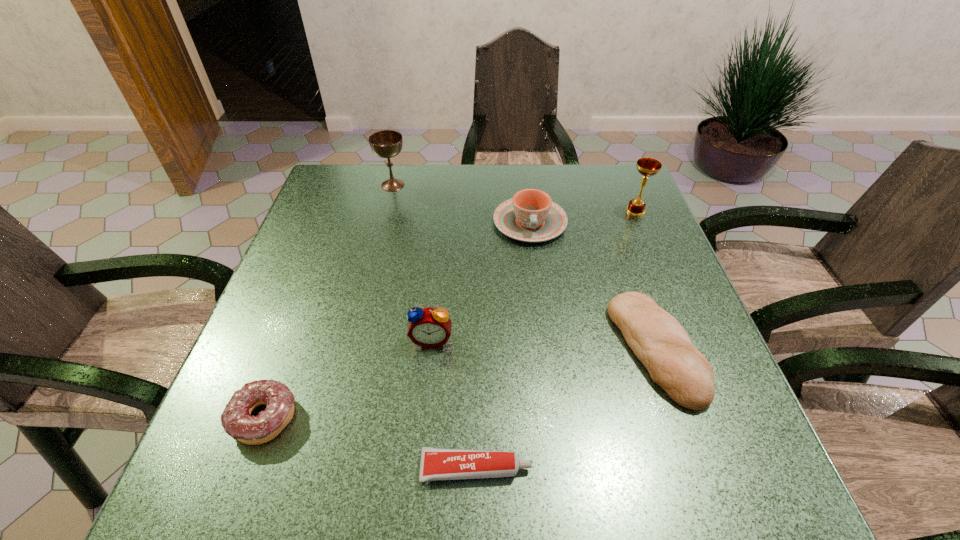
Find the location of a particular element. empty space that is in between the shortest object and the fifth tallest object is located at coordinates (565, 409).

Where is `vacant area between the nearer chalice and the leftmost object`? Image resolution: width=960 pixels, height=540 pixels. vacant area between the nearer chalice and the leftmost object is located at coordinates (450, 314).

Identify the location of the fourth closest object to the nearest object. (530, 216).

Identify the location of object that is the fifth closest to the bread. (236, 419).

Locate an element on the screen. The height and width of the screenshot is (540, 960). vacant space that satisfies the following two spatial constraints: 1. on the back side of the doughnut; 2. on the left side of the sixth object from right to left is located at coordinates (350, 185).

Locate an element on the screen. The image size is (960, 540). vacant region that satisfies the following two spatial constraints: 1. on the handle side of the chinaware; 2. at the nozzle of the toothpaste is located at coordinates pos(562,469).